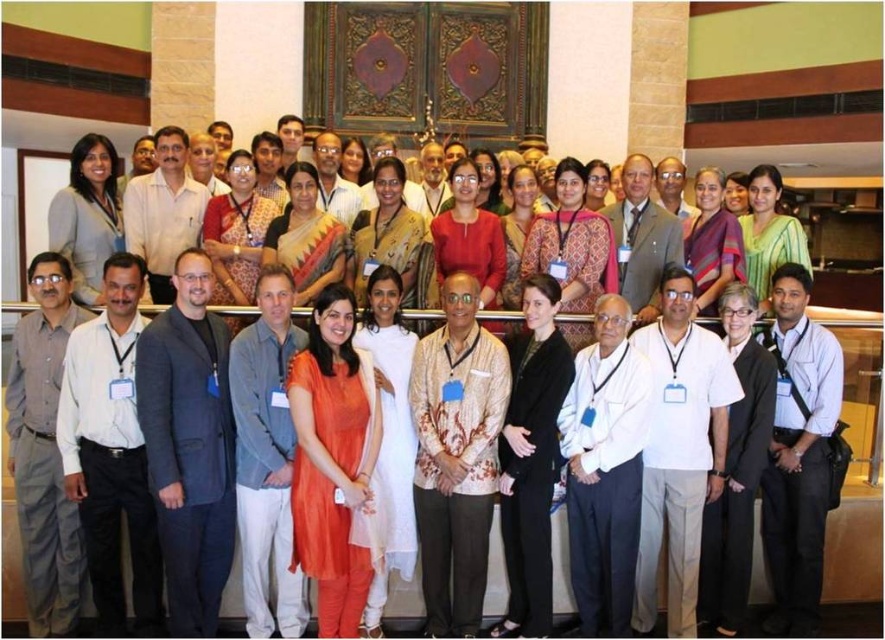
Question: Which point is farther to the camera?

Choices:
 (A) white shirt at center
 (B) patterned beige shirt at center
 (C) white cotton shirt at center

Answer: (A)

Question: Among these objects, which one is farthest from the camera?

Choices:
 (A) patterned beige shirt at center
 (B) white cotton shirt at center

Answer: (A)

Question: Which of the following is the closest to the observer?

Choices:
 (A) (635, 172)
 (B) (122, 307)

Answer: (B)

Question: Does patterned beige shirt at center have a lesser width compared to light brown textured shirt at center?

Choices:
 (A) yes
 (B) no

Answer: (A)

Question: Is the position of white shirt at left more distant than that of white shirt at center?

Choices:
 (A) yes
 (B) no

Answer: (B)

Question: Does patterned beige shirt at center appear over white cotton shirt at center?

Choices:
 (A) yes
 (B) no

Answer: (A)